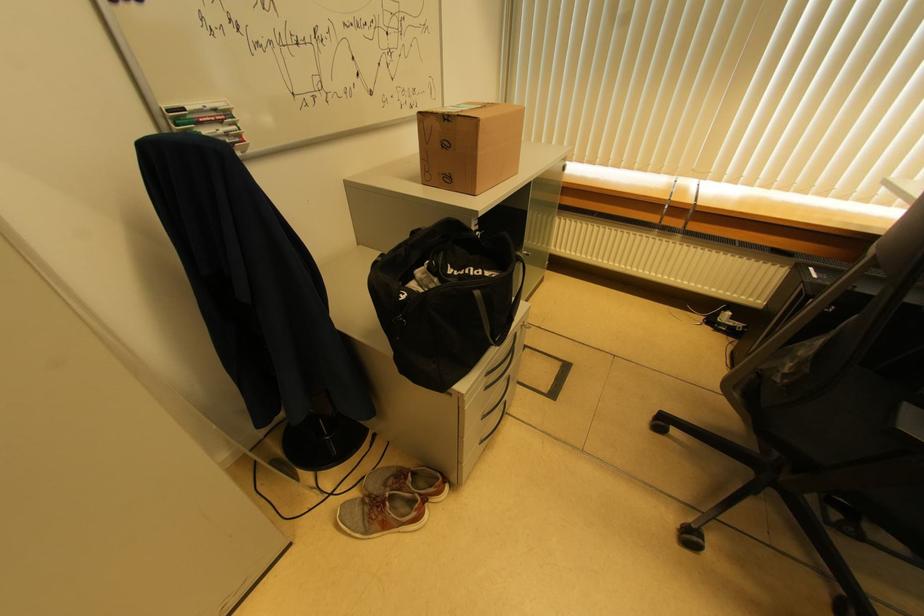
Find where to lift the blue whiteboard marker. Please return your answer as a coordinate pair (x, y).

(219, 128)